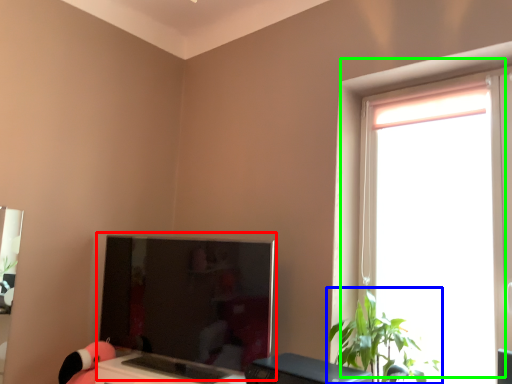
Question: Which object is the closest to the computer monitor (highlighted by a red box)? Choose among these: houseplant (highlighted by a blue box) or window (highlighted by a green box).

Choices:
 (A) houseplant
 (B) window

Answer: (A)